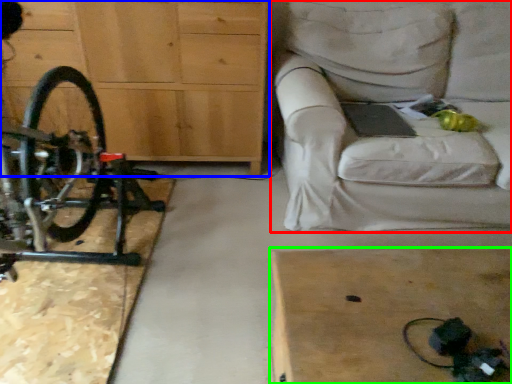
Question: Considering the real-world distances, which object is closest to studio couch (highlighted by a red box)? chest of drawers (highlighted by a blue box) or table (highlighted by a green box).

Choices:
 (A) chest of drawers
 (B) table

Answer: (A)